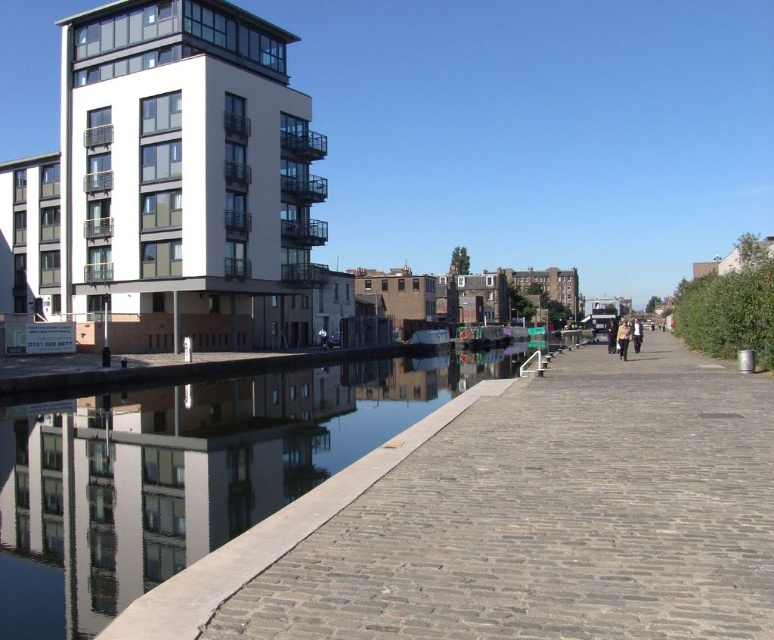
You are standing at the origin point in the image. Which direction should you move to reach the brown brick pavement at center?

The brown brick pavement at center is located at coordinates point (x=550, y=518), so you should move towards the right and downward direction to reach it.

You are standing on the walkway in the waterfront scene and see a brown leather jacket at center and dark blue jeans at center. Which item takes up less space in the scene?

The brown leather jacket at center is smaller than the dark blue jeans at center, so it takes up less space in the scene.